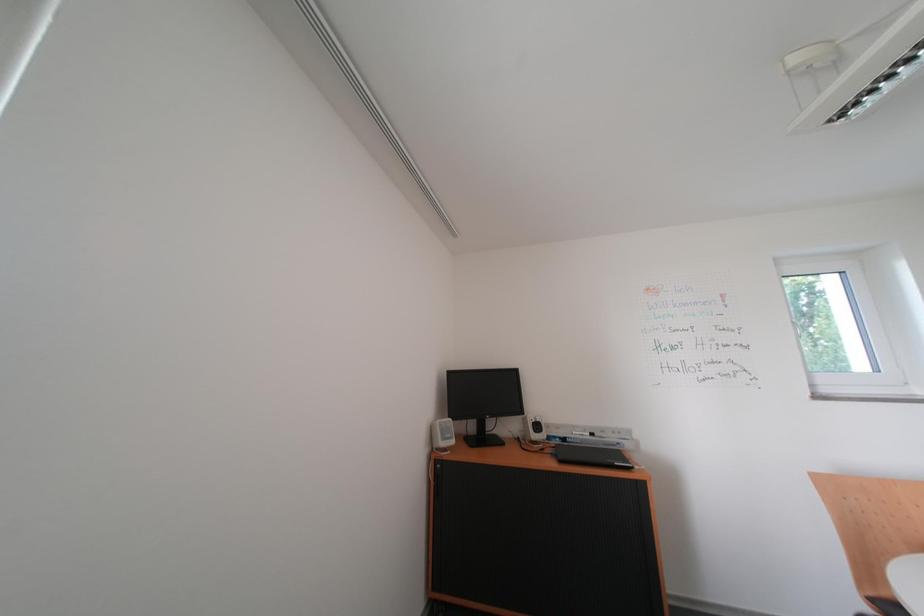
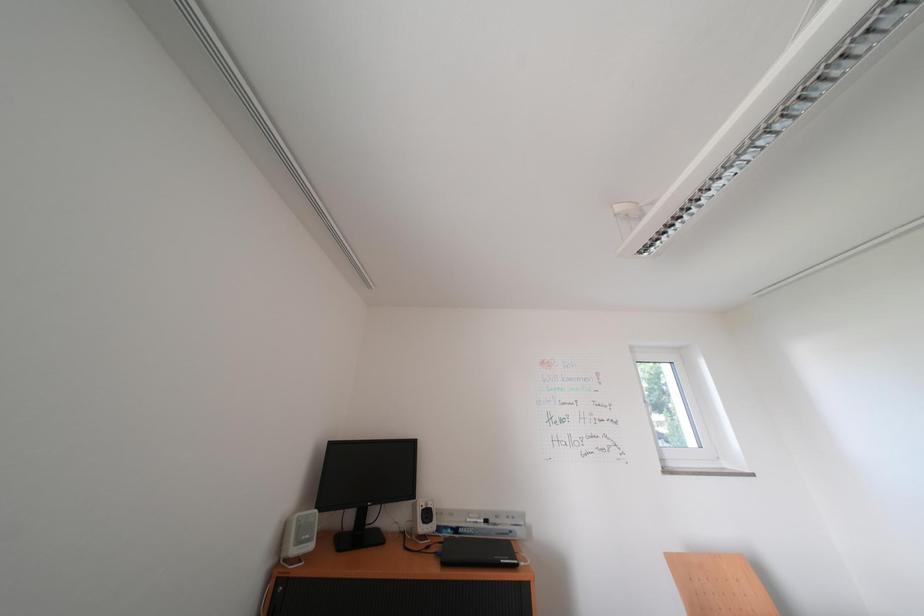
Question: The camera is either moving clockwise (left) or counter-clockwise (right) around the object. The first image is from the beginning of the video and the second image is from the end. Is the camera moving left or right when shooting the video?

Choices:
 (A) Left
 (B) Right

Answer: (A)